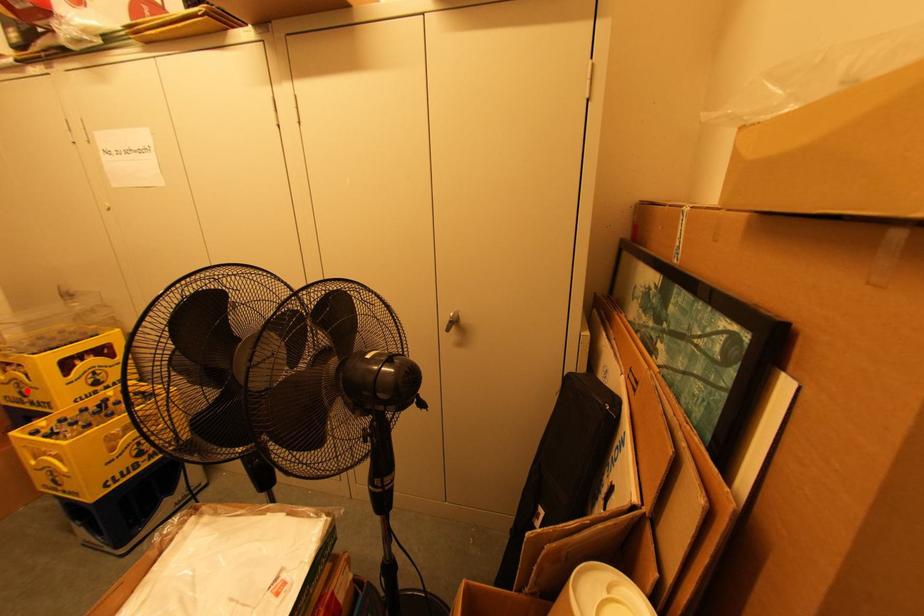
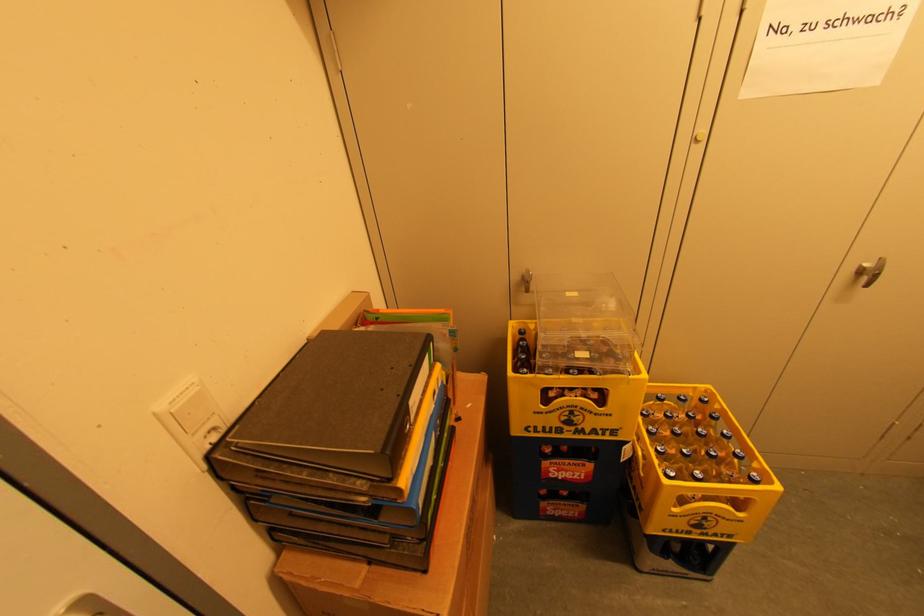
Where in the second image is the point corresponding to the highlighted location from the first image?

(578, 419)